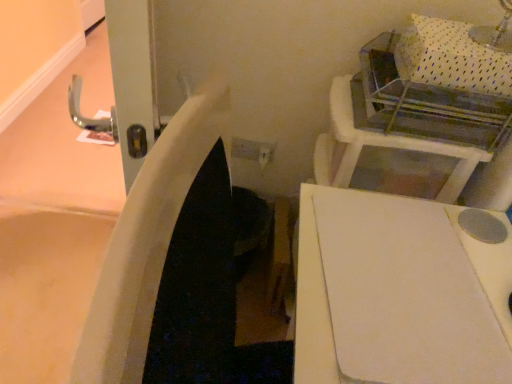
Question: Do you think white plastic vanity at upper right is within white matte cutting board at center, or outside of it?

Choices:
 (A) inside
 (B) outside

Answer: (B)

Question: Considering the relative positions of white plastic vanity at upper right and white matte cutting board at center in the image provided, is white plastic vanity at upper right to the left or to the right of white matte cutting board at center?

Choices:
 (A) left
 (B) right

Answer: (B)

Question: Is white plastic vanity at upper right in front of or behind white matte cutting board at center in the image?

Choices:
 (A) front
 (B) behind

Answer: (B)

Question: Considering the positions of white matte cutting board at center and white plastic vanity at upper right in the image, is white matte cutting board at center taller or shorter than white plastic vanity at upper right?

Choices:
 (A) short
 (B) tall

Answer: (A)

Question: Considering the positions of white matte cutting board at center and white plastic vanity at upper right in the image, is white matte cutting board at center bigger or smaller than white plastic vanity at upper right?

Choices:
 (A) big
 (B) small

Answer: (B)

Question: Is white matte cutting board at center spatially inside white plastic vanity at upper right, or outside of it?

Choices:
 (A) outside
 (B) inside

Answer: (A)

Question: From the image's perspective, is white matte cutting board at center located above or below white plastic vanity at upper right?

Choices:
 (A) above
 (B) below

Answer: (B)